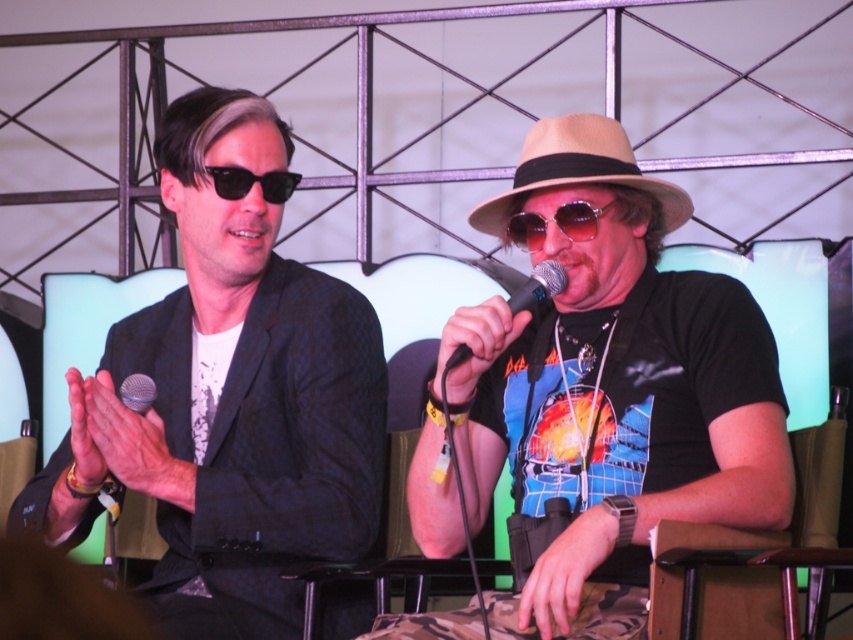
You are attending a convention and need to sit down. You see the camo fabric chair at lower center and the shiny purple goggles at center. Which object is taller?

The camo fabric chair at lower center is much taller than the shiny purple goggles at center.

From the picture: You are standing in front of the panel discussion setup and want to place a small plant between the two points marked as point (610, 556) and point (132, 388). Which point should the plant be closer to in order to be nearer to the person on the right?

The plant should be placed closer to point (132, 388) to be nearer to the person on the right since point (132, 388) is farther from the viewer compared to point (610, 556), meaning it is closer to the person on the right who is positioned at the right side of the image.